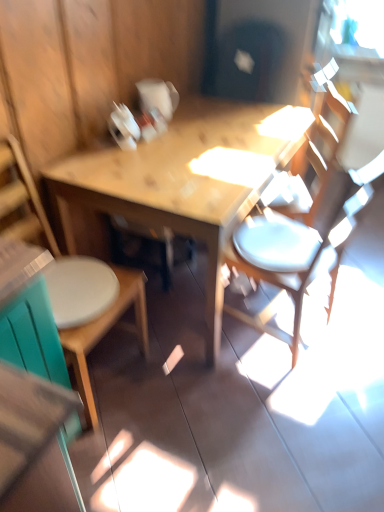
Question: Can you confirm if wooden table at center is bigger than white matte chair at right, which ranks as the 2th chair in left-to-right order?

Choices:
 (A) yes
 (B) no

Answer: (A)

Question: Is wooden table at center positioned with its back to white matte chair at right, which ranks as the 2th chair in left-to-right order?

Choices:
 (A) no
 (B) yes

Answer: (A)

Question: Does wooden table at center have a lesser height compared to white matte chair at right, placed as the 1th chair when sorted from right to left?

Choices:
 (A) yes
 (B) no

Answer: (A)

Question: Does wooden table at center come behind white matte chair at right, placed as the 1th chair when sorted from right to left?

Choices:
 (A) yes
 (B) no

Answer: (A)

Question: Are wooden table at center and white matte chair at right, which ranks as the 2th chair in left-to-right order, far apart?

Choices:
 (A) no
 (B) yes

Answer: (A)

Question: From the image's perspective, is wooden table at center located above or below wooden chair at left, the second chair when ordered from right to left?

Choices:
 (A) above
 (B) below

Answer: (A)

Question: In terms of height, does wooden table at center look taller or shorter compared to wooden chair at left, which is counted as the first chair, starting from the left?

Choices:
 (A) short
 (B) tall

Answer: (A)

Question: Based on their sizes in the image, would you say wooden table at center is bigger or smaller than wooden chair at left, the second chair when ordered from right to left?

Choices:
 (A) big
 (B) small

Answer: (A)

Question: Based on their positions, is wooden table at center located to the left or right of wooden chair at left, which is counted as the first chair, starting from the left?

Choices:
 (A) left
 (B) right

Answer: (B)

Question: From a real-world perspective, relative to wooden table at center, is white matte chair at right, which ranks as the 2th chair in left-to-right order, vertically above or below?

Choices:
 (A) above
 (B) below

Answer: (A)

Question: Is white matte chair at right, placed as the 1th chair when sorted from right to left, in front of or behind wooden table at center in the image?

Choices:
 (A) behind
 (B) front

Answer: (B)

Question: Which is correct: white matte chair at right, which ranks as the 2th chair in left-to-right order, is inside wooden table at center, or outside of it?

Choices:
 (A) inside
 (B) outside

Answer: (B)

Question: Visually, is white matte chair at right, which ranks as the 2th chair in left-to-right order, positioned to the left or to the right of wooden table at center?

Choices:
 (A) left
 (B) right

Answer: (B)

Question: In terms of height, does wooden table at center look taller or shorter compared to white matte chair at right, which ranks as the 2th chair in left-to-right order?

Choices:
 (A) tall
 (B) short

Answer: (B)

Question: Based on their sizes in the image, would you say wooden table at center is bigger or smaller than white matte chair at right, which ranks as the 2th chair in left-to-right order?

Choices:
 (A) small
 (B) big

Answer: (B)